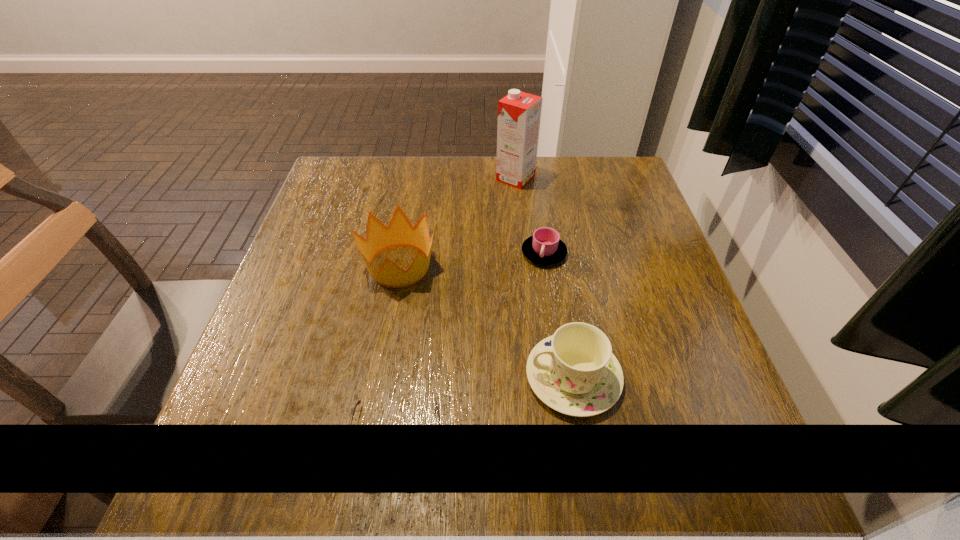
Where is `free space at the far right corner of the desktop`? free space at the far right corner of the desktop is located at coordinates (579, 173).

At what (x,y) coordinates should I click in order to perform the action: click on vacant space that's between the cup and the tallest object. Please return your answer as a coordinate pair (x, y). This screenshot has width=960, height=540. Looking at the image, I should click on (530, 215).

Locate an element on the screen. free spot between the cup and the chinaware is located at coordinates (559, 315).

Where is `empty space that is in between the farthest object and the crown`? Image resolution: width=960 pixels, height=540 pixels. empty space that is in between the farthest object and the crown is located at coordinates (458, 222).

Identify the location of empty space between the farthest object and the cup. Image resolution: width=960 pixels, height=540 pixels. (530, 215).

The image size is (960, 540). What are the coordinates of `vacant space in between the tallest object and the sunglasses` in the screenshot? It's located at (455, 308).

You are a GUI agent. You are given a task and a screenshot of the screen. Output one action in this format:
    pyautogui.click(x=<x>, y=<y>)
    Task: Click on the vacant space in between the crown and the chinaware
    This screenshot has width=960, height=540.
    Given the screenshot: What is the action you would take?
    coord(487,321)

Where is `free space between the cup and the sunglasses`? free space between the cup and the sunglasses is located at coordinates (469, 346).

The image size is (960, 540). What are the coordinates of `vacant area between the cup and the crown` in the screenshot? It's located at (471, 259).

Locate an element on the screen. This screenshot has width=960, height=540. empty location between the sunglasses and the crown is located at coordinates (397, 352).